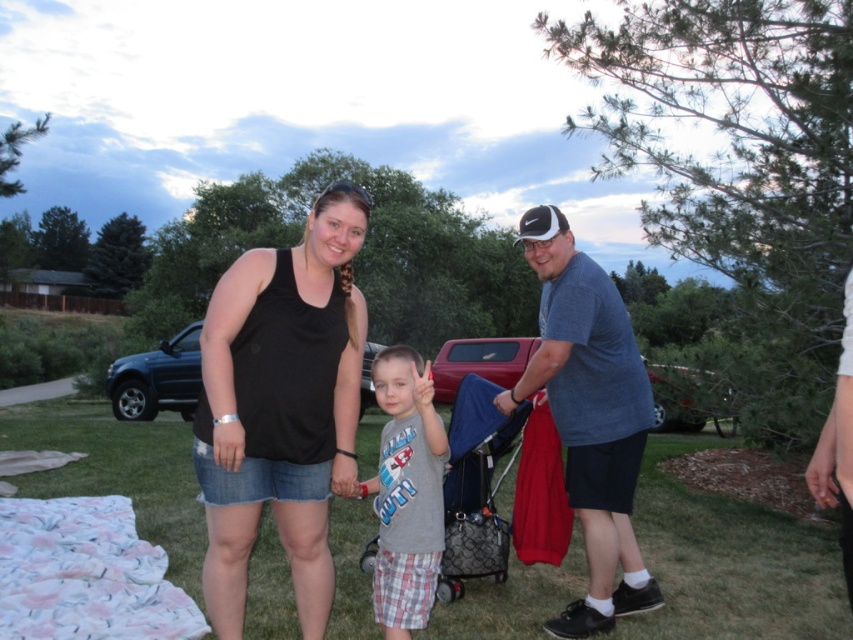
What do you see at coordinates (281, 406) in the screenshot?
I see `black cotton tank top at center` at bounding box center [281, 406].

Measure the distance between black cotton tank top at center and blue fabric stroller at center.

black cotton tank top at center is 37.36 inches from blue fabric stroller at center.

Between point (432, 412) and point (492, 390), which one is positioned in front?

Point (432, 412) is in front.

The image size is (853, 640). I want to click on black cotton tank top at center, so click(281, 406).

Which is behind, point (585, 372) or point (132, 616)?

Point (132, 616)

Can you confirm if blue cotton shirt at center is shorter than fluffy cotton blanket at lower left?

No, blue cotton shirt at center is not shorter than fluffy cotton blanket at lower left.

This screenshot has height=640, width=853. I want to click on blue cotton shirt at center, so coord(589,417).

Where is `blue cotton shirt at center`? The height and width of the screenshot is (640, 853). blue cotton shirt at center is located at coordinates (589, 417).

Does black cotton tank top at center have a smaller size compared to fluffy cotton blanket at lower left?

No.

Who is positioned more to the left, black cotton tank top at center or fluffy cotton blanket at lower left?

fluffy cotton blanket at lower left is more to the left.

Between point (227, 541) and point (44, 547), which one is positioned behind?

The point (44, 547) is behind.

At what (x,y) coordinates should I click in order to perform the action: click on black cotton tank top at center. Please return your answer as a coordinate pair (x, y). Looking at the image, I should click on (281, 406).